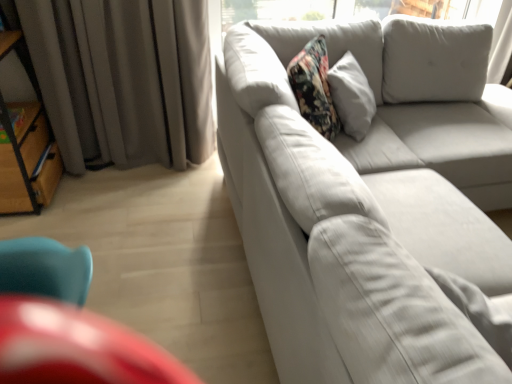
Question: From a real-world perspective, relative to white fabric couch at right, is gray fabric curtain at left vertically above or below?

Choices:
 (A) below
 (B) above

Answer: (B)

Question: Does point (109, 140) appear closer or farther from the camera than point (435, 109)?

Choices:
 (A) closer
 (B) farther

Answer: (B)

Question: Which object is the farthest from the white fabric couch at right?

Choices:
 (A) woodenmaterial/texturebookshelf at left
 (B) gray fabric curtain at left
 (C) white fabric pillow at center

Answer: (A)

Question: Considering the real-world distances, which object is closest to the white fabric couch at right?

Choices:
 (A) woodenmaterial/texturebookshelf at left
 (B) gray fabric curtain at left
 (C) white fabric pillow at center

Answer: (C)